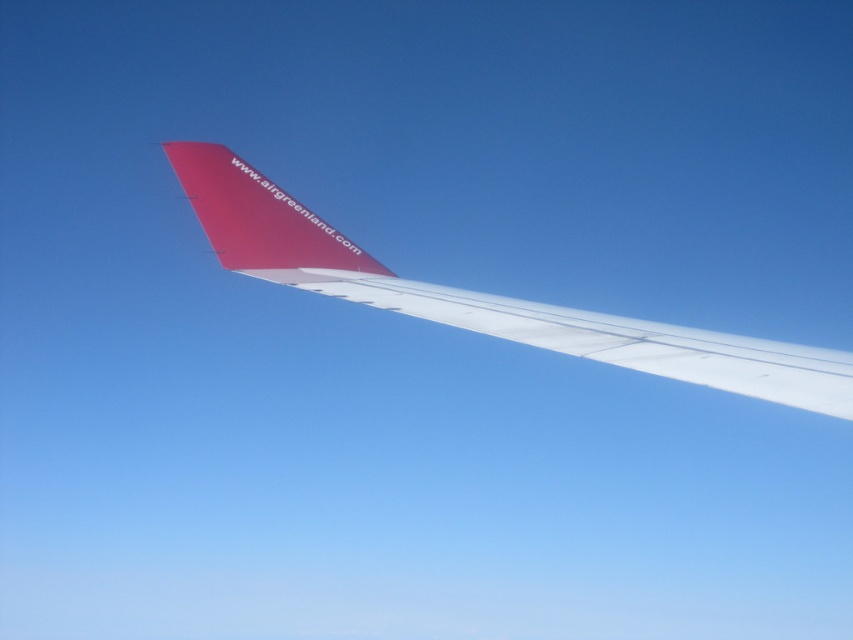
You are a photographer trying to capture the airplane wing and its tail. Based on the scene, which object would appear closer to you in the photo? The white matte wing at center or the smooth red airplane tail at upper center?

The white matte wing at center appears closer to you because it is positioned in front of the smooth red airplane tail at upper center.

You are a pilot preparing for a flight and need to check the wing and tail for any damage. Which object, the polished white wing at center or the smooth red airplane tail at upper center, has a smaller width?

The polished white wing at center is thinner than the smooth red airplane tail at upper center, so the polished white wing at center has a smaller width.